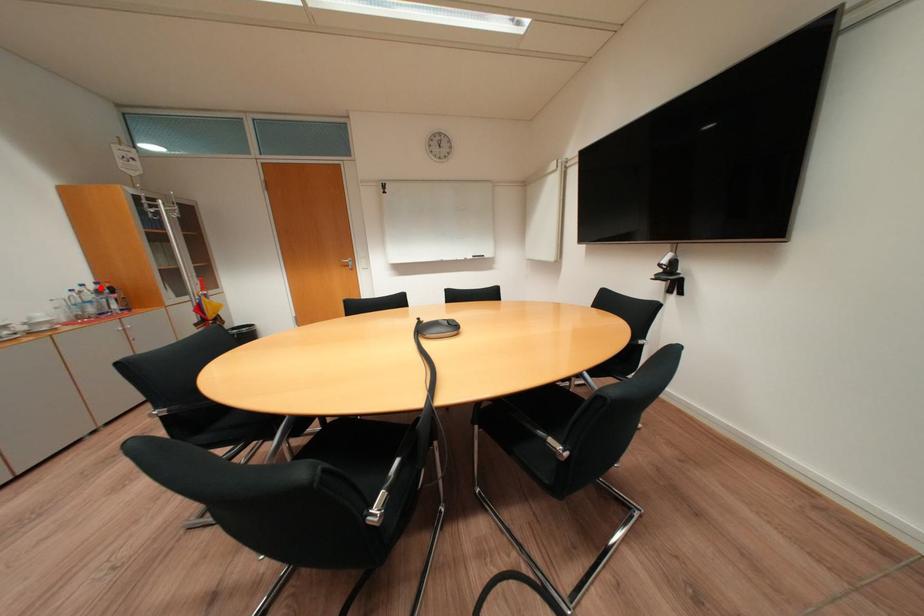
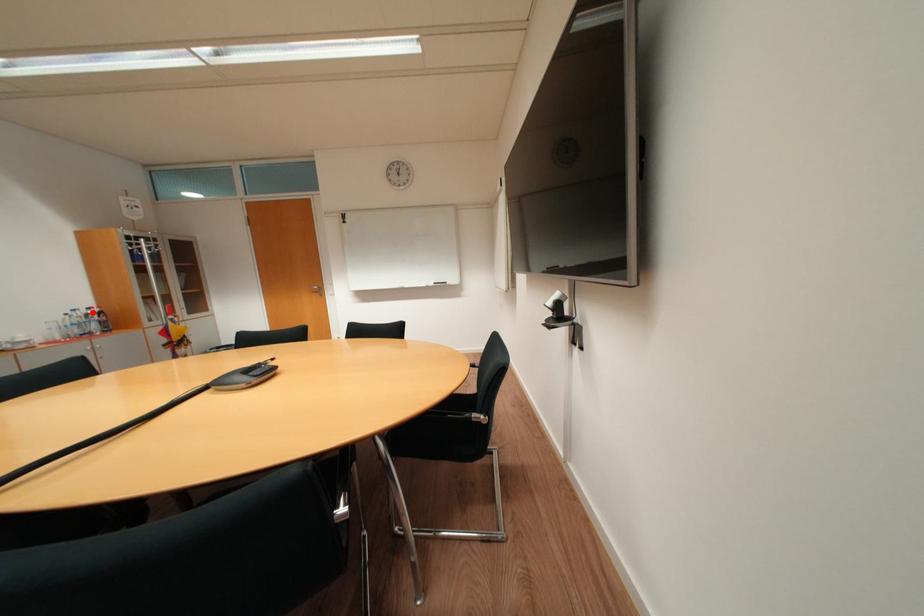
I am providing you with two images of the same scene from different viewpoints. A red point is marked on the first image and another point is marked on the second image. Do the highlighted points in image1 and image2 indicate the same real-world spot?

Yes